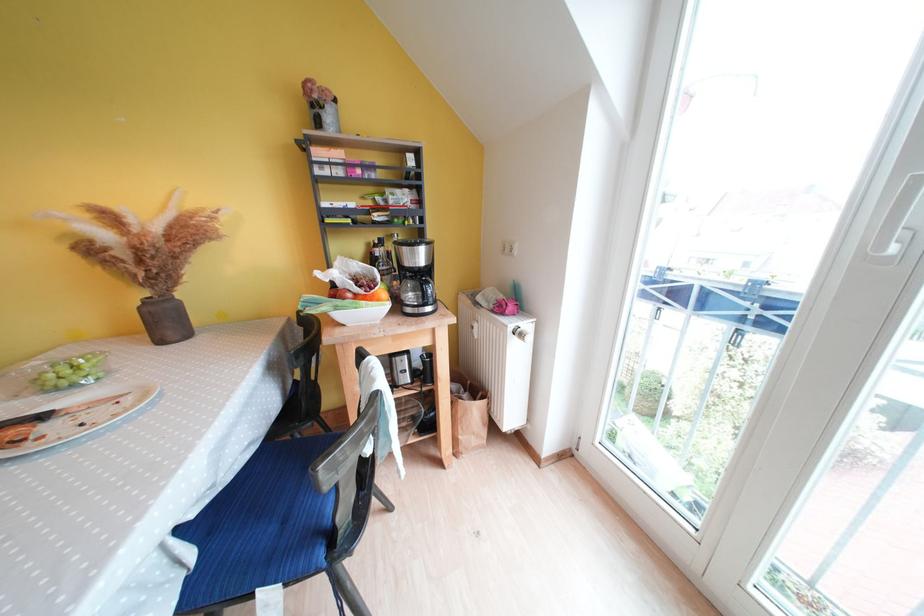
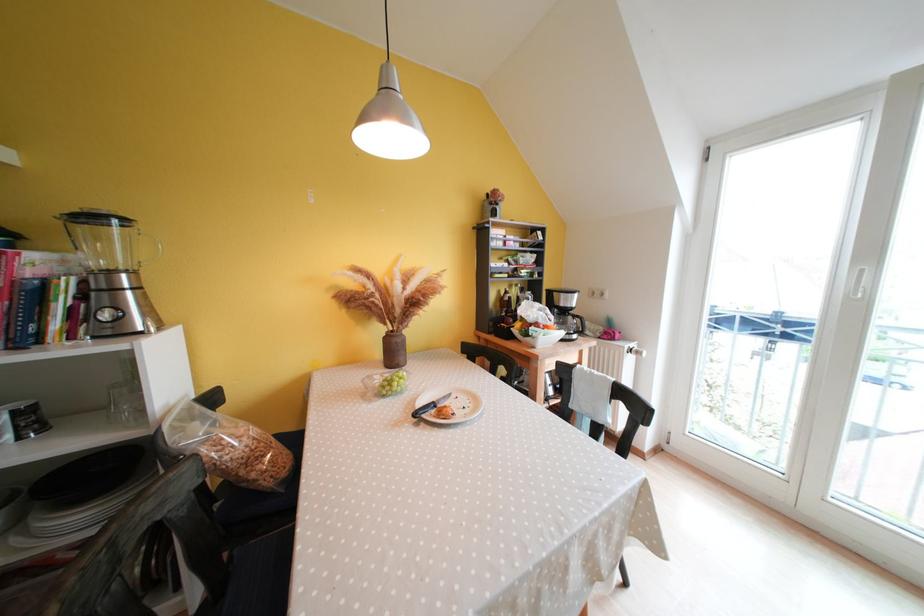
Based on the photo, in a continuous first-person perspective shot, in which direction is the camera moving?

The movement direction of the cameraman is left, backward.